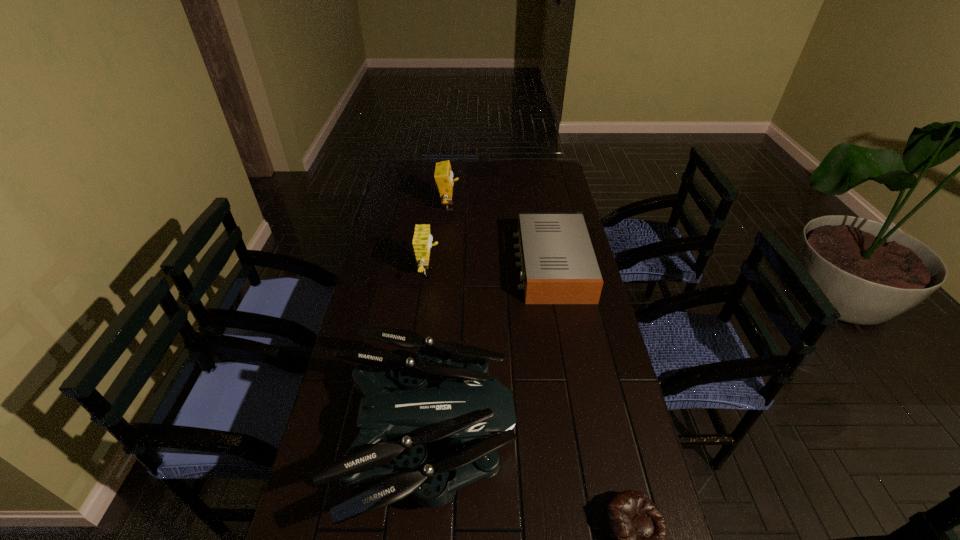
The height and width of the screenshot is (540, 960). Find the location of `vacant space at the left edge of the desktop`. vacant space at the left edge of the desktop is located at coordinates (382, 280).

Identify the location of free spot at the right edge of the desktop. (539, 190).

The height and width of the screenshot is (540, 960). What are the coordinates of `vacant space that's between the farthest object and the fourth tallest object` in the screenshot? It's located at (500, 236).

The width and height of the screenshot is (960, 540). I want to click on empty space that is in between the farthest object and the nearer sponge, so click(439, 240).

Locate an element on the screen. free spot between the radio receiver and the farthest object is located at coordinates (500, 236).

The width and height of the screenshot is (960, 540). Identify the location of object that is the second closest to the shortest object. coord(559,266).

I want to click on object identified as the third closest to the beanbag, so 422,240.